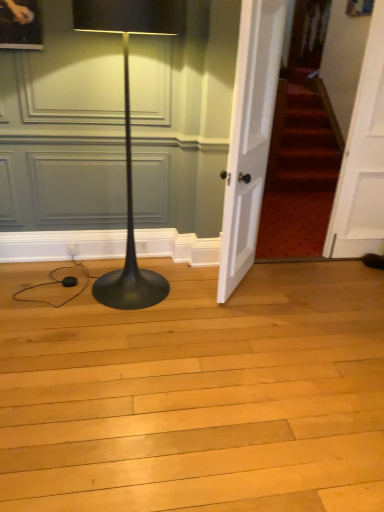
You are a GUI agent. You are given a task and a screenshot of the screen. Output one action in this format:
    pyautogui.click(x=<x>, y=<y>)
    Task: Click on the free spot to the left of white wooden door at center, the second door when ordered from right to left
    Image resolution: width=384 pixels, height=512 pixels.
    Given the screenshot: What is the action you would take?
    pyautogui.click(x=189, y=290)